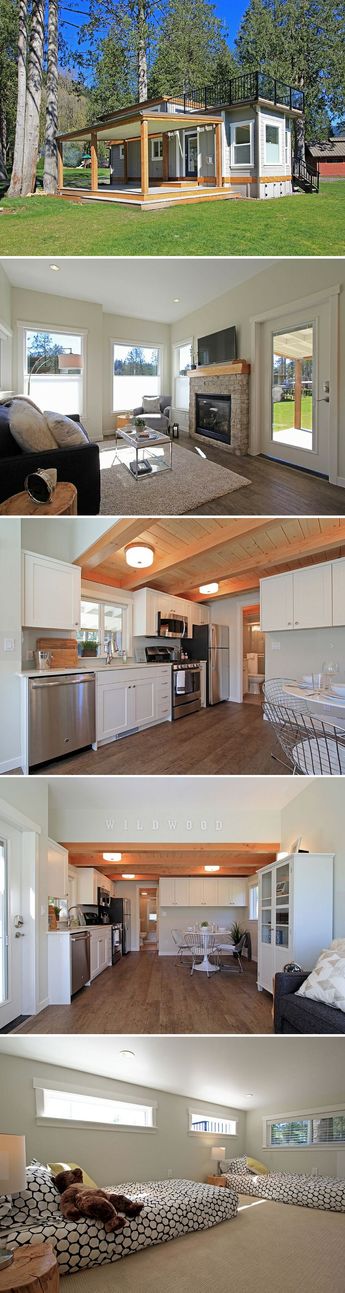
Where is `pillows`? Image resolution: width=345 pixels, height=1293 pixels. pillows is located at coordinates (256, 1160), (237, 1162), (52, 1182), (60, 1165), (327, 975), (67, 434), (32, 427), (26, 396).